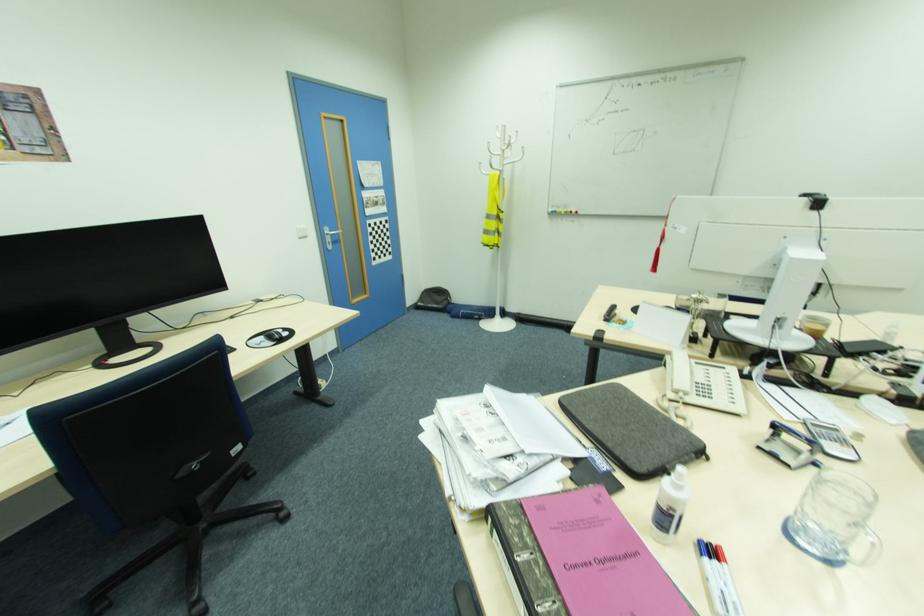
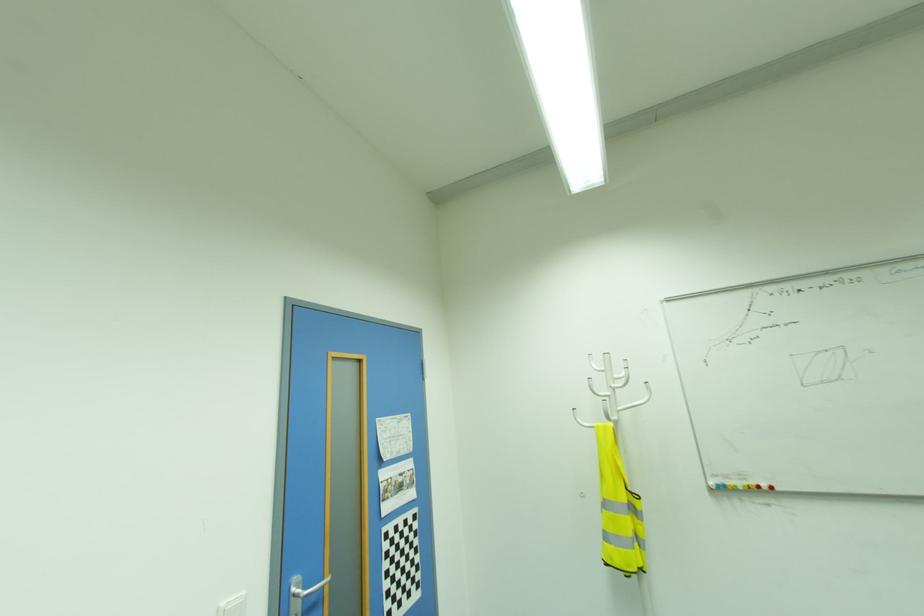
The point at (301,225) is marked in the first image. Where is the corresponding point in the second image?

(226, 602)